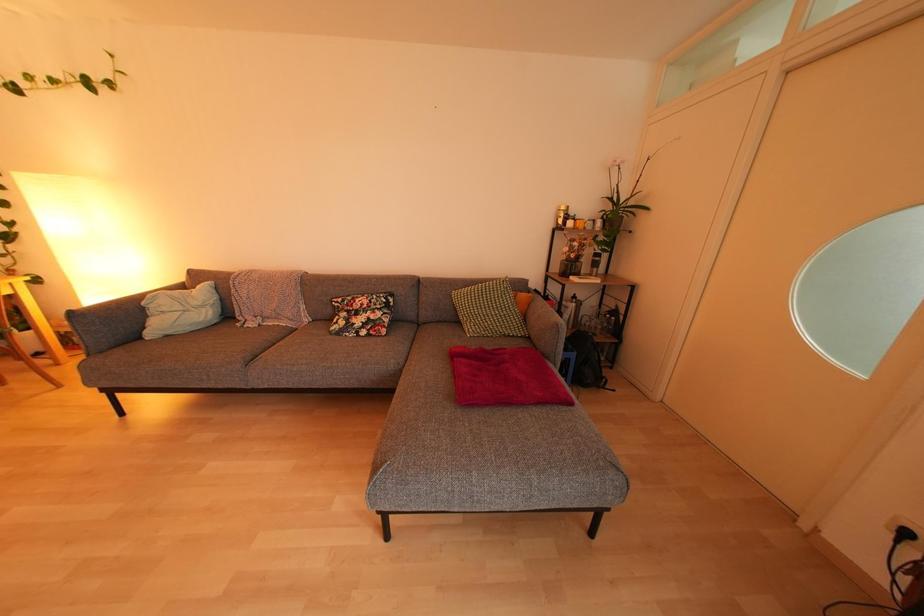
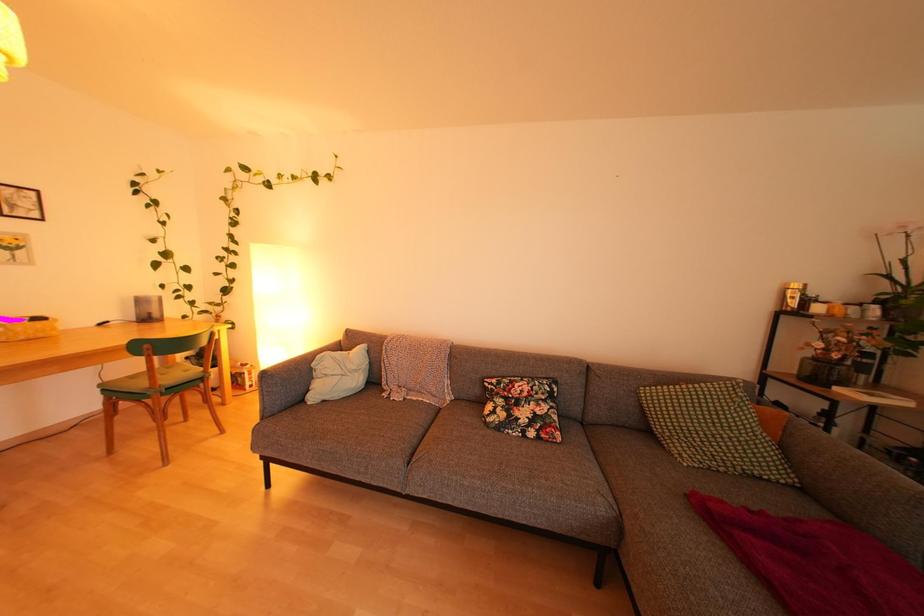
Question: The images are taken continuously from a first-person perspective. In which direction is your viewpoint rotating?

Choices:
 (A) Left
 (B) Right
 (C) Up
 (D) Down

Answer: (A)